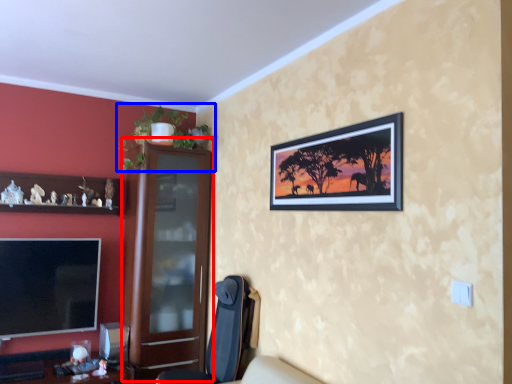
Question: Which point is closer to the camera, dresser (highlighted by a red box) or houseplant (highlighted by a blue box)?

Choices:
 (A) dresser
 (B) houseplant

Answer: (B)